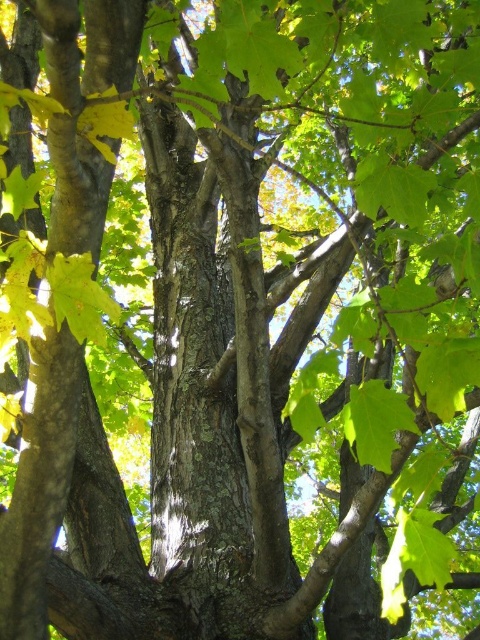
Question: Is green matte leaf at lower right positioned in front of green matte leaf at center?

Choices:
 (A) yes
 (B) no

Answer: (B)

Question: Does green matte leaf at center appear on the left side of yellow matte leaf at upper left?

Choices:
 (A) yes
 (B) no

Answer: (B)

Question: Can you confirm if green matte leaf at lower right is positioned to the left of yellow matte leaf at upper left?

Choices:
 (A) no
 (B) yes

Answer: (A)

Question: Which point is farther from the camera taking this photo?

Choices:
 (A) (424, 176)
 (B) (97, 129)
 (C) (358, 435)
 (D) (95, 291)

Answer: (C)

Question: Which object is the farthest from the green matte leaf at center?

Choices:
 (A) green matte leaf at lower right
 (B) green matte maple leaf at upper right
 (C) yellow matte leaf at upper left
 (D) green matte maple leaf at upper left

Answer: (C)

Question: Estimate the real-world distances between objects in this image. Which object is closer to the green matte leaf at center?

Choices:
 (A) green matte maple leaf at upper left
 (B) green matte leaf at lower right
 (C) yellow matte leaf at upper left
 (D) green matte maple leaf at upper right

Answer: (B)